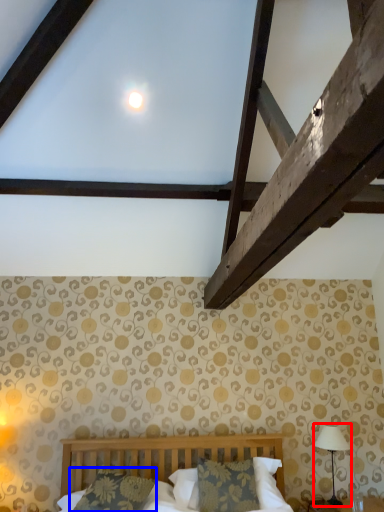
Question: Which object is closer to the camera taking this photo, table lamp (highlighted by a red box) or pillow (highlighted by a blue box)?

Choices:
 (A) table lamp
 (B) pillow

Answer: (B)